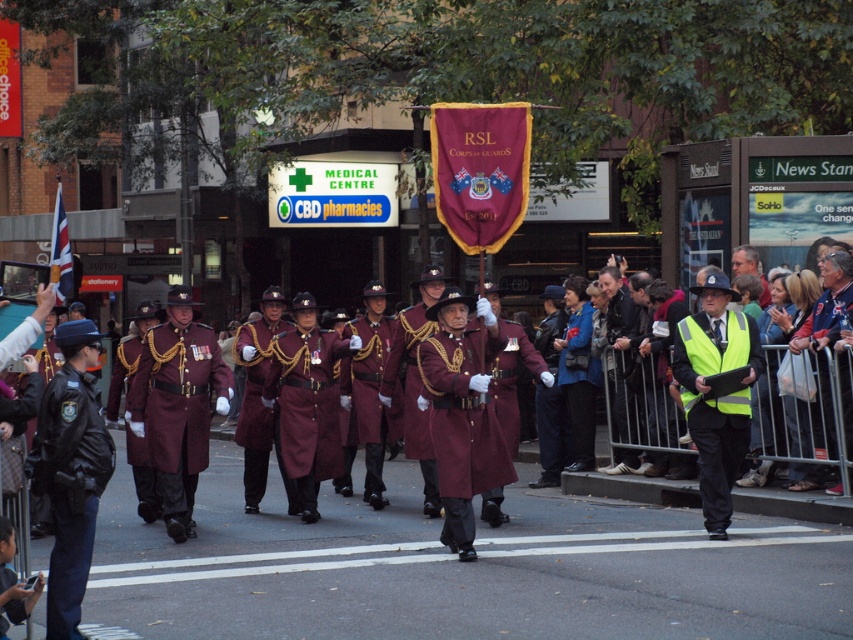
You are a photographer trying to capture the entire parade scene. You notice a leather jacket at right, represented by point (618, 305). Where should you position yourself to include both the marching group and the leather jacket at right in your shot?

Position yourself to the left of the marching group to include both the marching group and the leather jacket at right in your shot.

You are a photographer trying to capture the Corps of Guards during the parade. You notice two maroon items at the center of the image. Which one is bigger in size between the maroon fabric coat at center and the maroon uniform at center?

The maroon fabric coat at center is larger in size than the maroon uniform at center according to the description provided.

You are a photographer positioned at the center of the street during the parade. You want to capture a photo of the leather jacket at right without including the marching RSL Corps of Guards. Where should you position your camera relative to the jacket?

The leather jacket at right is located at point [618,305]. To avoid including the marching RSL Corps of Guards, position the camera to the left of the leather jacket at right, ensuring the guards are out of frame.